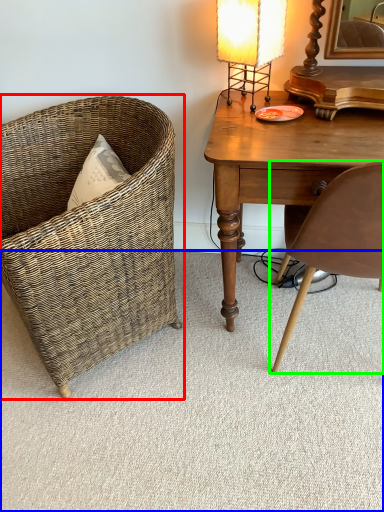
Question: Which is farther away from chair (highlighted by a red box)? plain (highlighted by a blue box) or chair (highlighted by a green box)?

Choices:
 (A) plain
 (B) chair

Answer: (B)